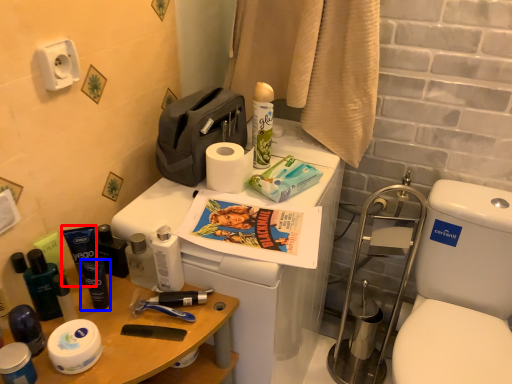
Question: Which of the following is the farthest to the observer, toiletry (highlighted by a red box) or toiletry (highlighted by a blue box)?

Choices:
 (A) toiletry
 (B) toiletry

Answer: (A)